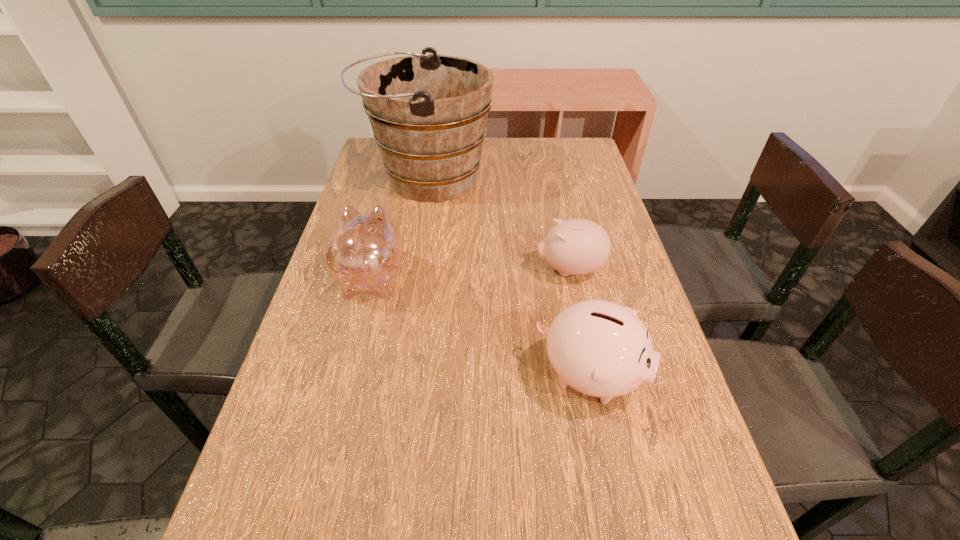
Where is `free point between the shortest piggy bank and the leftmost piggy bank`? The image size is (960, 540). free point between the shortest piggy bank and the leftmost piggy bank is located at coordinates (470, 274).

Find the location of a particular element. The width and height of the screenshot is (960, 540). vacant area that lies between the farthest object and the nearest piggy bank is located at coordinates (509, 276).

Where is `empty location between the nearest object and the tallest object`? empty location between the nearest object and the tallest object is located at coordinates (509, 276).

I want to click on free space between the farthest object and the nearest piggy bank, so click(x=509, y=276).

The height and width of the screenshot is (540, 960). I want to click on vacant point located between the tallest object and the nearest piggy bank, so click(509, 276).

Identify the location of free space between the bucket and the nearest piggy bank. (509, 276).

Image resolution: width=960 pixels, height=540 pixels. I want to click on vacant point located between the bucket and the shortest piggy bank, so click(x=498, y=223).

Point out which object is positioned as the nearest to the nearest piggy bank. Please provide its 2D coordinates. Your answer should be formatted as a tuple, i.e. [(x, y)], where the tuple contains the x and y coordinates of a point satisfying the conditions above.

[(576, 246)]

Find the location of a particular element. The height and width of the screenshot is (540, 960). object that is the second nearest to the leftmost piggy bank is located at coordinates (602, 349).

Where is `piggy bank that is the nearest to the leftmost piggy bank`? Image resolution: width=960 pixels, height=540 pixels. piggy bank that is the nearest to the leftmost piggy bank is located at coordinates (602, 349).